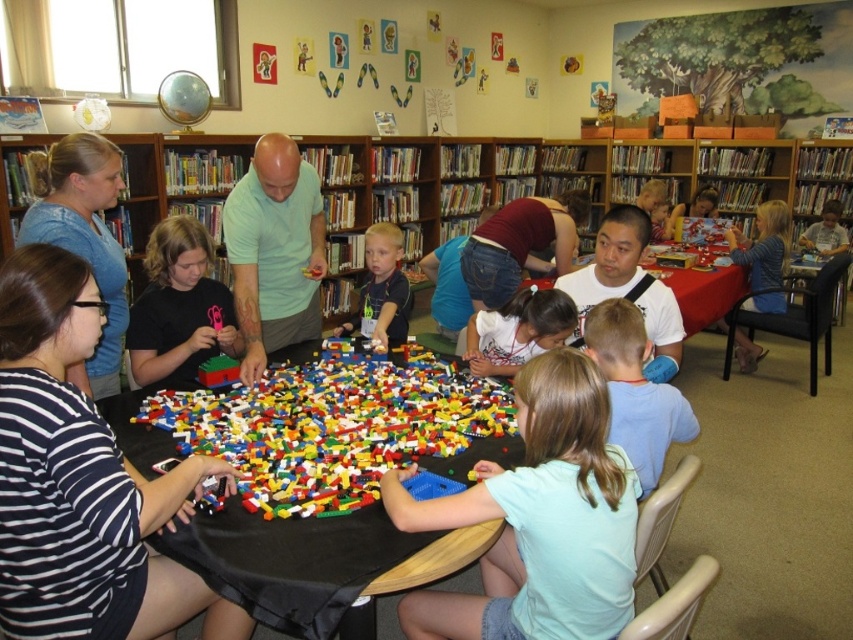
Question: Among these objects, which one is nearest to the camera?

Choices:
 (A) blue denim shirt at upper left
 (B) blue cotton shirt at lower center
 (C) light green shirt at center
 (D) matte black shirt at center

Answer: (B)

Question: Is light blue matte shirt at center closer to camera compared to smooth blue shirt at center?

Choices:
 (A) yes
 (B) no

Answer: (A)

Question: From the image, what is the correct spatial relationship of light blue matte shirt at center in relation to smooth blue shirt at center?

Choices:
 (A) below
 (B) above

Answer: (A)

Question: Based on their relative distances, which object is farther from the white matte shirt at center?

Choices:
 (A) blue cotton shirt at lower center
 (B) wooden table at center
 (C) light green shirt at center

Answer: (B)

Question: Which point is farther to the camera?

Choices:
 (A) (811, 227)
 (B) (372, 248)
 (C) (538, 308)

Answer: (A)

Question: Is light blue matte shirt at center positioned behind blue denim shirt at upper left?

Choices:
 (A) yes
 (B) no

Answer: (B)